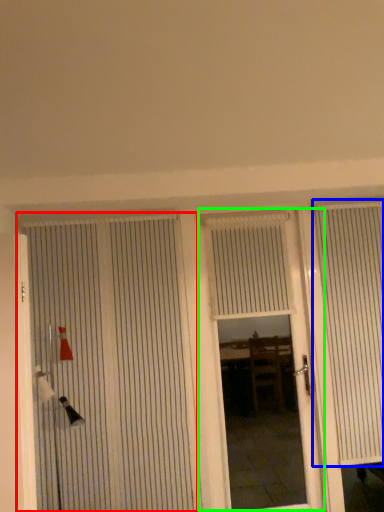
Question: Which object is positioned farthest from door (highlighted by a red box)? Select from curtain (highlighted by a blue box) and door (highlighted by a green box).

Choices:
 (A) curtain
 (B) door

Answer: (B)